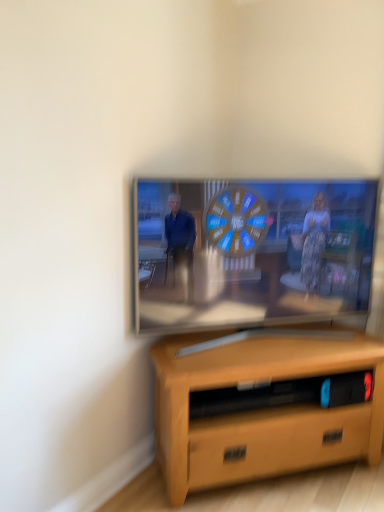
The height and width of the screenshot is (512, 384). What do you see at coordinates (260, 408) in the screenshot? I see `light brown wood desk at lower center` at bounding box center [260, 408].

The height and width of the screenshot is (512, 384). Identify the location of light brown wood desk at lower center. (260, 408).

Consider the image. What is the approximate width of light brown wood desk at lower center?

14.07 inches.

Locate an element on the screen. The width and height of the screenshot is (384, 512). matte wooden tv at center is located at coordinates (251, 252).

What do you see at coordinates (251, 252) in the screenshot?
I see `matte wooden tv at center` at bounding box center [251, 252].

At what (x,y) coordinates should I click in order to perform the action: click on light brown wood desk at lower center. Please return your answer as a coordinate pair (x, y). Image resolution: width=384 pixels, height=512 pixels. Looking at the image, I should click on (260, 408).

Is matte wooden tv at center at the left side of light brown wood desk at lower center?

Indeed, matte wooden tv at center is positioned on the left side of light brown wood desk at lower center.

Is the depth of matte wooden tv at center less than that of light brown wood desk at lower center?

No.

Considering the points (226, 313) and (203, 360), which point is behind, point (226, 313) or point (203, 360)?

The point (226, 313) is farther.

From the image's perspective, would you say matte wooden tv at center is positioned over light brown wood desk at lower center?

Yes, from the image's perspective, matte wooden tv at center is above light brown wood desk at lower center.

From a real-world perspective, is matte wooden tv at center positioned over light brown wood desk at lower center based on gravity?

Yes.

Can you confirm if matte wooden tv at center is wider than light brown wood desk at lower center?

No.

Between matte wooden tv at center and light brown wood desk at lower center, which one has less height?

With less height is light brown wood desk at lower center.

Between matte wooden tv at center and light brown wood desk at lower center, which one has larger size?

With larger size is light brown wood desk at lower center.

Can we say matte wooden tv at center lies outside light brown wood desk at lower center?

Yes, matte wooden tv at center is outside of light brown wood desk at lower center.

Are matte wooden tv at center and light brown wood desk at lower center beside each other?

They are not placed beside each other.

Could you tell me if matte wooden tv at center is facing light brown wood desk at lower center?

No.

How different are the orientations of matte wooden tv at center and light brown wood desk at lower center in degrees?

0.357 degrees.

Identify the location of television above the light brown wood desk at lower center (from a real-world perspective). (251, 252).

Considering the relative positions of light brown wood desk at lower center and matte wooden tv at center in the image provided, is light brown wood desk at lower center to the left of matte wooden tv at center from the viewer's perspective?

In fact, light brown wood desk at lower center is to the right of matte wooden tv at center.

Considering the positions of objects light brown wood desk at lower center and matte wooden tv at center in the image provided, who is in front, light brown wood desk at lower center or matte wooden tv at center?

light brown wood desk at lower center is closer to the camera.

Does point (248, 464) appear closer or farther from the camera than point (144, 190)?

Point (248, 464).

From the image's perspective, between light brown wood desk at lower center and matte wooden tv at center, which one is located above?

matte wooden tv at center.

From a real-world perspective, relative to matte wooden tv at center, is light brown wood desk at lower center vertically above or below?

light brown wood desk at lower center is below matte wooden tv at center.

In terms of width, does light brown wood desk at lower center look wider or thinner when compared to matte wooden tv at center?

In the image, light brown wood desk at lower center appears to be wider than matte wooden tv at center.

In the scene shown: Who is shorter, light brown wood desk at lower center or matte wooden tv at center?

light brown wood desk at lower center.

From the picture: Between light brown wood desk at lower center and matte wooden tv at center, which one has smaller size?

Smaller between the two is matte wooden tv at center.

Is light brown wood desk at lower center inside the boundaries of matte wooden tv at center, or outside?

light brown wood desk at lower center is not inside matte wooden tv at center, it's outside.

Can you see light brown wood desk at lower center touching matte wooden tv at center?

No.

Is light brown wood desk at lower center oriented away from matte wooden tv at center?

No.

How many degrees apart are the facing directions of light brown wood desk at lower center and matte wooden tv at center?

There is a 0.357-degree angle between the facing directions of light brown wood desk at lower center and matte wooden tv at center.

The height and width of the screenshot is (512, 384). Identify the location of desk located on the right of matte wooden tv at center. (260, 408).

You are a GUI agent. You are given a task and a screenshot of the screen. Output one action in this format:
    pyautogui.click(x=<x>, y=<y>)
    Task: Click on the desk on the right of matte wooden tv at center
    
    Given the screenshot: What is the action you would take?
    pyautogui.click(x=260, y=408)

The height and width of the screenshot is (512, 384). Find the location of `television above the light brown wood desk at lower center (from the image's perspective)`. television above the light brown wood desk at lower center (from the image's perspective) is located at coordinates (251, 252).